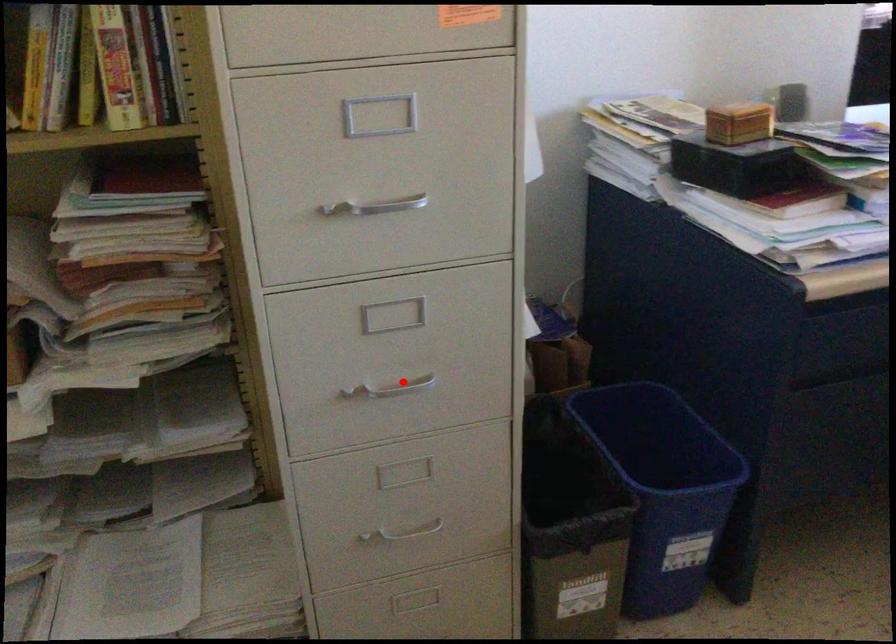
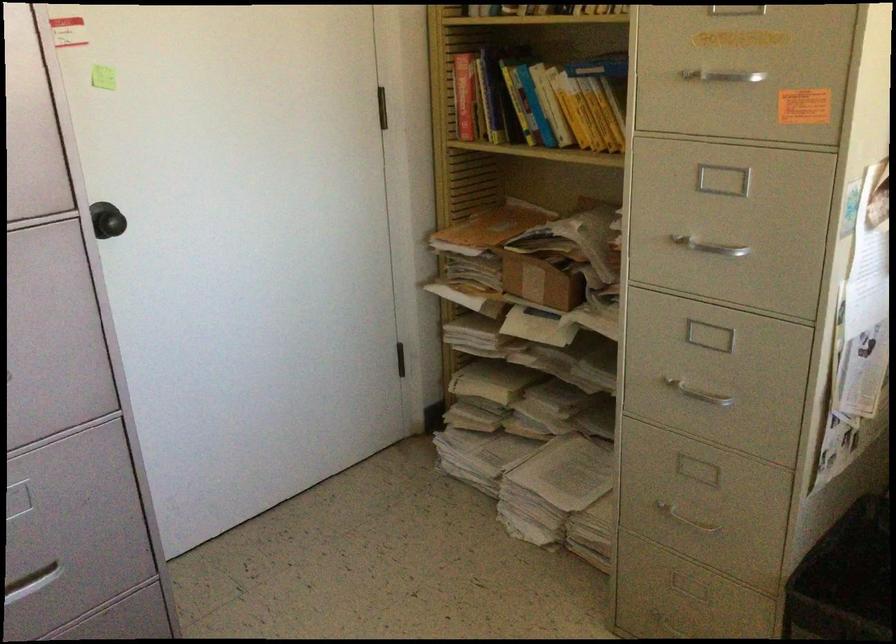
Question: A red point is marked in image1. In image2, is the corresponding 3D point closer to the camera or farther? Reply with the corresponding letter.

Choices:
 (A) The corresponding 3D point is closer.
 (B) The corresponding 3D point is farther.

Answer: (B)